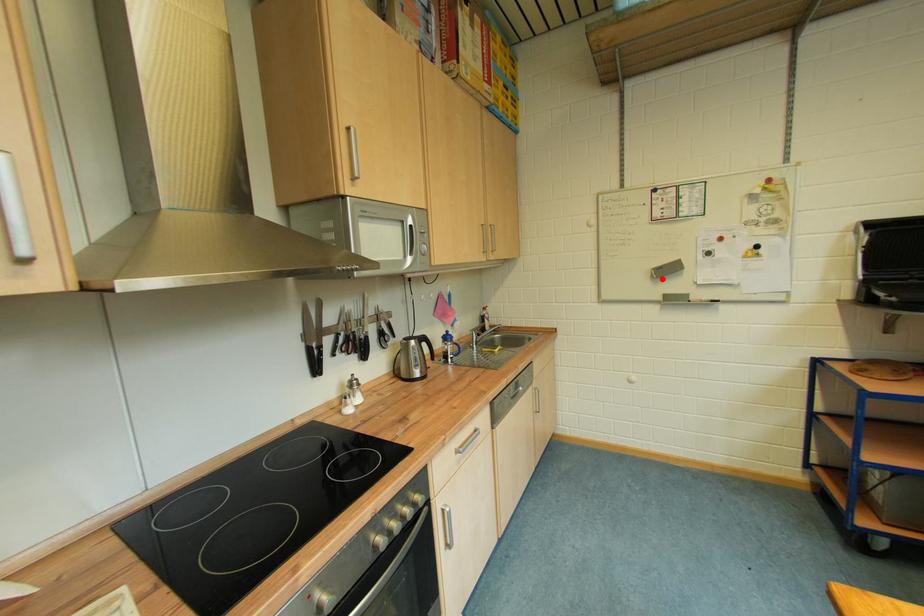
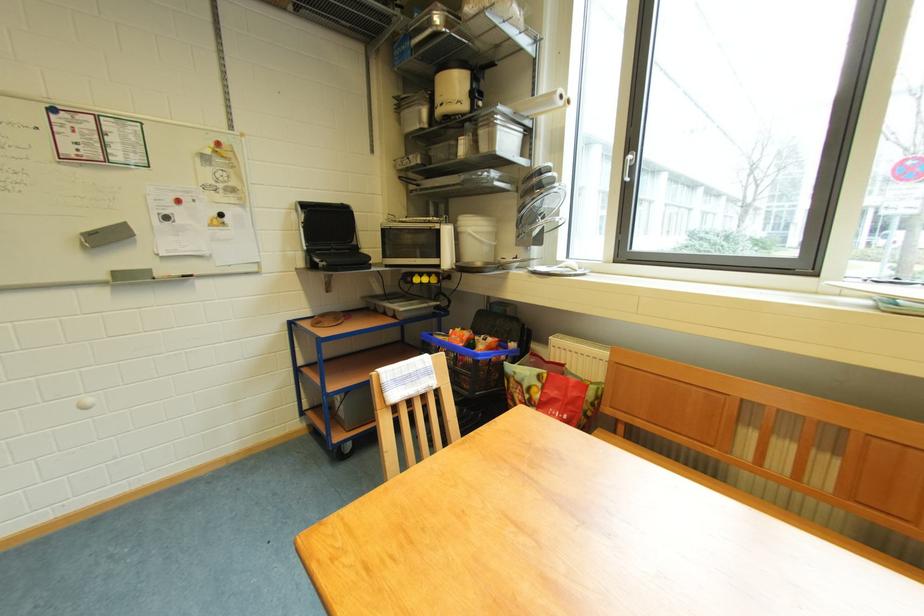
The point at the highlighted location is marked in the first image. Where is the corresponding point in the second image?

(95, 248)